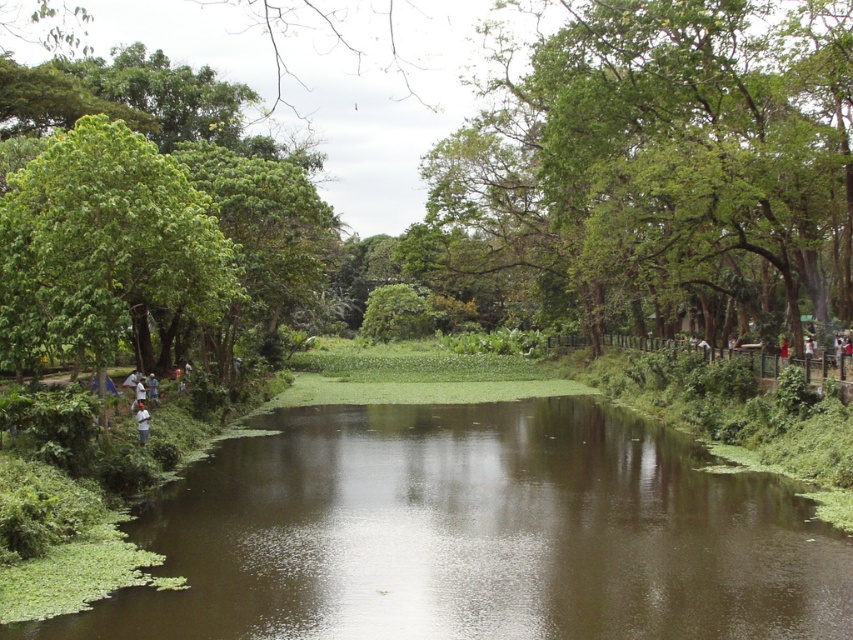
You are standing at the edge of the waterway in the scene. You notice a point marked at coordinates [660,168]. What object does this point indicate?

The point at coordinates [660,168] corresponds to the green leafy tree at upper center.

You are standing at the point closest to the water in the scene. Which of the two points, point (x=579, y=237) or point (x=138, y=412), is farther away from your current position?

Point (x=579, y=237) is farther away from your current position because it is behind point (x=138, y=412).

You are standing at the camera position and want to take a photo of the green leafy tree at upper center. If your camera has a maximum zoom range of 100 feet, will you be able to capture the tree in focus without moving closer?

The green leafy tree at upper center and camera are 89.45 feet apart from each other. Since the maximum zoom range is 100 feet, the camera can focus on the tree without moving closer because 89.45 feet is within the 100 feet limit.